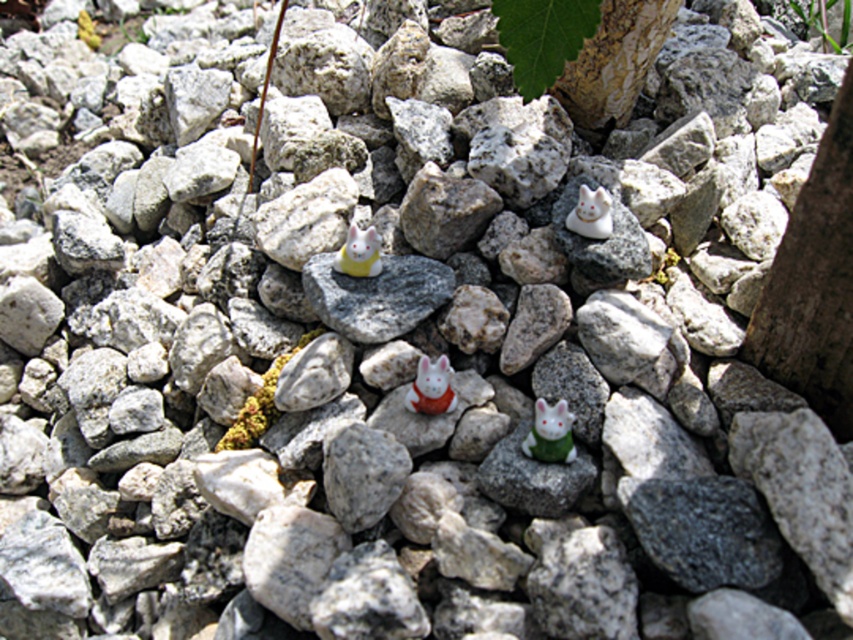
You are standing in front of the scene with rocks and rabbit figurines. You notice two points marked in the image. The first point is at coordinate point (430, 403) and the second is at point (816, 6). Which point is closer to you?

Point (430, 403) is in front of point (816, 6), so it is closer to you.

You are a collector who wants to place a new figurine between the white glossy cat at upper center and the yellow matte rabbit at center. The new figurine is 15 centimeters wide. Can you fit it in the space between them?

The distance between the white glossy cat at upper center and the yellow matte rabbit at center is 31.22 centimeters. Since the new figurine is only 15 centimeters wide, there is enough space to place it between them.